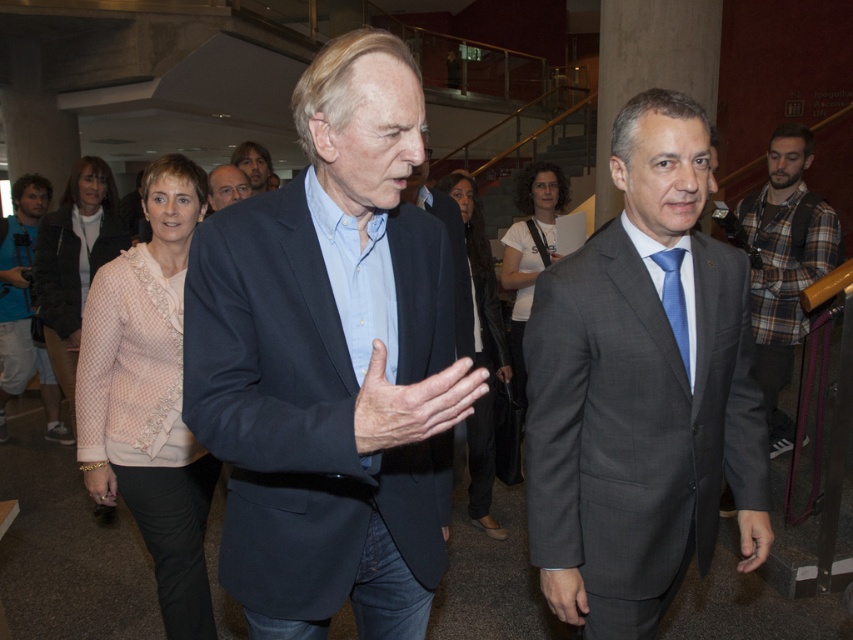
Question: Which point is closer to the camera?

Choices:
 (A) (463, 291)
 (B) (677, 280)
 (C) (264, 182)
 (D) (549, 365)

Answer: (D)

Question: Can you confirm if blue denim jeans at lower left is wider than blue textured tie at center?

Choices:
 (A) yes
 (B) no

Answer: (A)

Question: Which point is closer to the camera?

Choices:
 (A) (421, 112)
 (B) (770, 300)
 (C) (39, 353)

Answer: (A)

Question: Does dry skin hand at center appear on the right side of blue cotton shirt at center?

Choices:
 (A) no
 (B) yes

Answer: (A)

Question: Can you confirm if gray suit at center is bigger than blue cotton shirt at center?

Choices:
 (A) yes
 (B) no

Answer: (B)

Question: Which point appears farthest from the camera in this image?

Choices:
 (A) (241, 192)
 (B) (666, 316)
 (C) (630, 250)

Answer: (A)